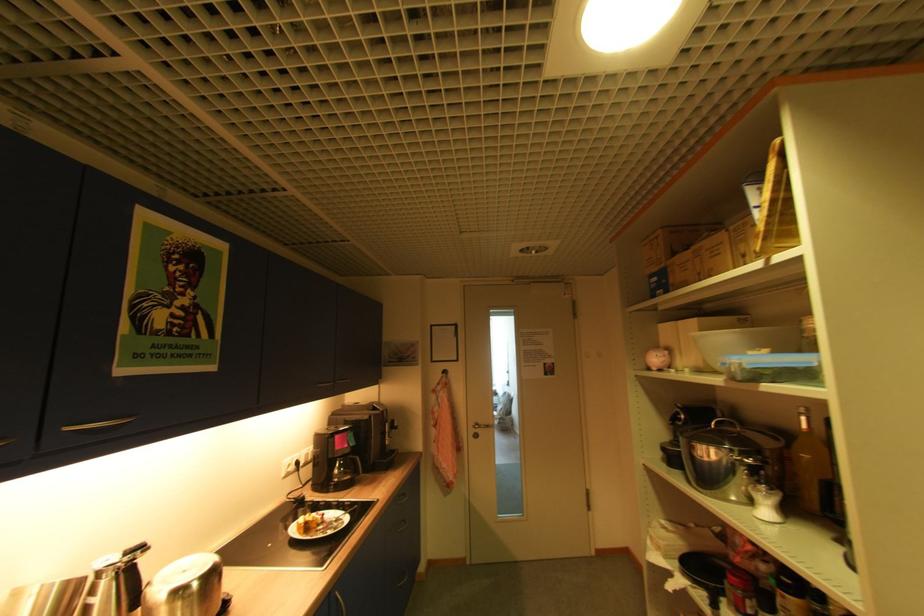
I want to click on frying pan handle, so point(751,461).